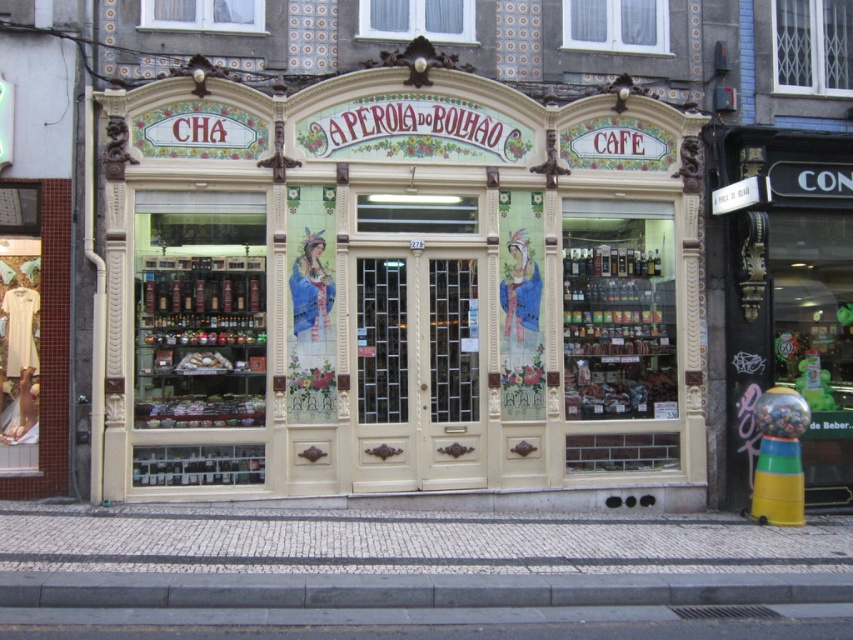
You are standing in front of the traditional Portuguese cafe named Aperola do Bolhao. You see a point at coordinates point (537, 276). Can you determine if this point is within a safe distance for a photographer to take a clear picture without needing a zoom lens?

The point at coordinates point (537, 276) is 35.75 feet away from the camera. A typical zoom lens can capture clear images up to 30 feet, so the photographer would need to use a zoom lens to capture the point clearly.

You are a delivery person trying to park your 1.2 meter wide delivery cart in front of the white painted wood storefront at center. The gray concrete curb at lower center is in the way. Can you park your cart there without overlapping the curb?

The white painted wood storefront at center has a smaller size compared to gray concrete curb at lower center. Since the curb is larger, it might block the parking space. The cart is 1.2 meters wide, but without knowing the exact dimensions of the storefront and curb, it is uncertain if there is enough space. However, since the storefront is smaller, the curb could extend further out, making parking difficult.